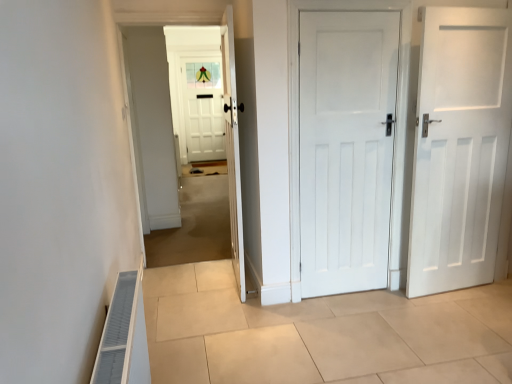
Find the location of a particular element. The image size is (512, 384). free space that is to the left of white matte door at right, arranged as the first door when viewed from the right is located at coordinates (409, 307).